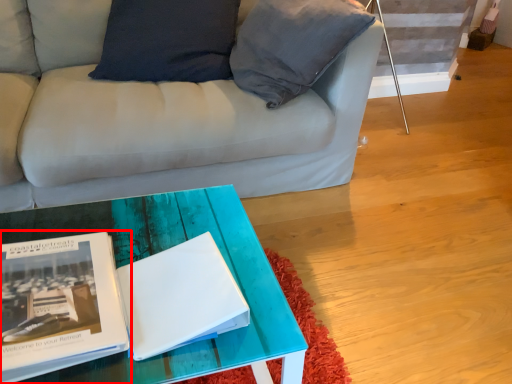
Question: From the image's perspective, considering the relative positions of book (annotated by the red box) and magazine in the image provided, where is book (annotated by the red box) located with respect to the staircase?

Choices:
 (A) below
 (B) above

Answer: (A)